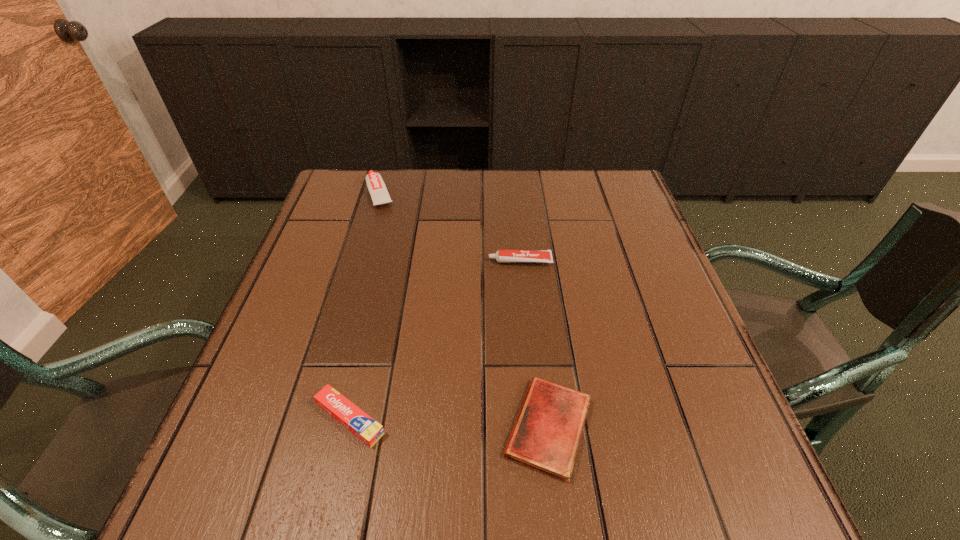
Where is `vacant space located 0.150m at the nozzle of the second shortest toothpaste`? vacant space located 0.150m at the nozzle of the second shortest toothpaste is located at coordinates (426, 261).

Where is `vacant region located 0.320m on the back of the shortest toothpaste`? This screenshot has width=960, height=540. vacant region located 0.320m on the back of the shortest toothpaste is located at coordinates (383, 272).

Locate an element on the screen. This screenshot has height=540, width=960. vacant space located 0.360m on the left of the diary is located at coordinates (294, 427).

You are a GUI agent. You are given a task and a screenshot of the screen. Output one action in this format:
    pyautogui.click(x=<x>, y=<y>)
    Task: Click on the object located at the far edge
    
    Given the screenshot: What is the action you would take?
    pyautogui.click(x=376, y=186)

Where is `object located in the near edge section of the desktop`? This screenshot has width=960, height=540. object located in the near edge section of the desktop is located at coordinates (546, 436).

Locate an element on the screen. This screenshot has width=960, height=540. object located at the far left corner is located at coordinates (376, 186).

You are a GUI agent. You are given a task and a screenshot of the screen. Output one action in this format:
    pyautogui.click(x=<x>, y=<y>)
    Task: Click on the vacant space at the far edge of the desktop
    This screenshot has height=540, width=960.
    Given the screenshot: What is the action you would take?
    [x=530, y=177]

At what (x,y) coordinates should I click in order to perform the action: click on vacant space at the near edge of the desktop. Please return your answer as a coordinate pair (x, y). This screenshot has height=540, width=960. Looking at the image, I should click on (383, 489).

In the image, there is a desktop. What are the coordinates of `vacant space at the left edge` in the screenshot? It's located at (360, 259).

The image size is (960, 540). What are the coordinates of `vacant space at the right edge of the desktop` in the screenshot? It's located at (636, 252).